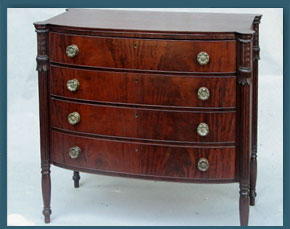
Locate an element on the screen. Image resolution: width=290 pixels, height=229 pixels. right side of dresser is located at coordinates (254, 84).